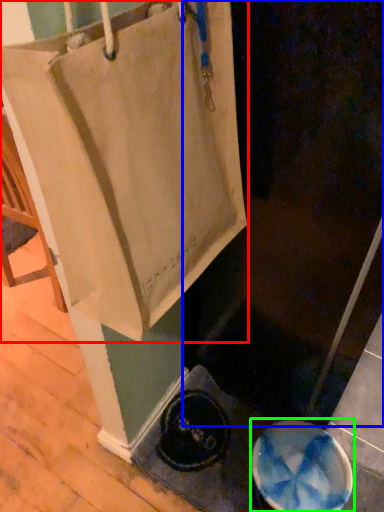
Question: Considering the real-world distances, which object is farthest from tote bag (highlighted by a red box)? screen door (highlighted by a blue box) or manhole cover (highlighted by a green box)?

Choices:
 (A) screen door
 (B) manhole cover

Answer: (B)